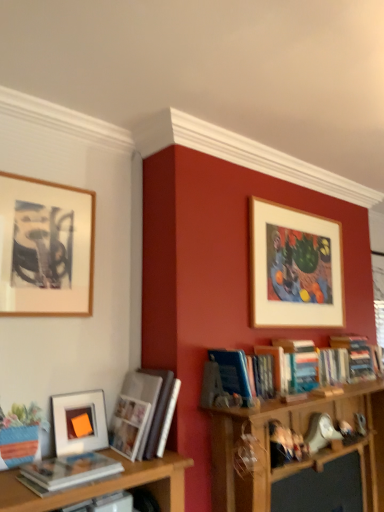
Question: Should I look upward or downward to see blue hardcover book at center-right, which is counted as the third book, starting from the right?

Choices:
 (A) up
 (B) down

Answer: (B)

Question: Is wooden framed artwork at upper left, the first picture frame positioned from the left, further to the viewer compared to hardcover books at upper right, which ranks as the 5th book in left-to-right order?

Choices:
 (A) yes
 (B) no

Answer: (B)

Question: Is hardcover books at upper right, which ranks as the 5th book in left-to-right order, a part of wooden framed artwork at upper left, placed as the 1th picture frame when sorted from front to back?

Choices:
 (A) yes
 (B) no

Answer: (B)

Question: Are wooden framed artwork at upper left, which is the third picture frame in back-to-front order, and hardcover books at upper right, the first book when ordered from right to left, far apart?

Choices:
 (A) yes
 (B) no

Answer: (A)

Question: Is wooden framed artwork at upper left, which is the third picture frame in back-to-front order, closer to the viewer compared to hardcover books at upper right, which ranks as the 5th book in left-to-right order?

Choices:
 (A) no
 (B) yes

Answer: (B)

Question: From a real-world perspective, is wooden framed artwork at upper left, placed as the 1th picture frame when sorted from front to back, over hardcover books at upper right, the first book when ordered from right to left?

Choices:
 (A) no
 (B) yes

Answer: (B)

Question: Is wooden framed artwork at upper left, the 3th picture frame positioned from the right, next to hardcover books at upper right, which ranks as the 5th book in left-to-right order?

Choices:
 (A) yes
 (B) no

Answer: (B)

Question: From the image's perspective, is matte white book at lower left, the 1th book when ordered from left to right, located beneath hardcover book at upper right, which is the 4th book from left to right?

Choices:
 (A) yes
 (B) no

Answer: (A)

Question: Is matte white book at lower left, which ranks as the fifth book in right-to-left order, wider than hardcover book at upper right, arranged as the second book when viewed from the right?

Choices:
 (A) yes
 (B) no

Answer: (A)

Question: Is matte white book at lower left, the 1th book when ordered from left to right, oriented towards hardcover book at upper right, which is the 4th book from left to right?

Choices:
 (A) yes
 (B) no

Answer: (B)

Question: Considering the relative sizes of matte white book at lower left, the 1th book when ordered from left to right, and hardcover book at upper right, which is the 4th book from left to right, in the image provided, is matte white book at lower left, the 1th book when ordered from left to right, thinner than hardcover book at upper right, which is the 4th book from left to right,?

Choices:
 (A) yes
 (B) no

Answer: (B)

Question: Is matte white book at lower left, the 1th book when ordered from left to right, outside hardcover book at upper right, arranged as the second book when viewed from the right?

Choices:
 (A) yes
 (B) no

Answer: (A)

Question: Is matte white book at lower left, the 1th book when ordered from left to right, facing away from hardcover book at upper right, which is the 4th book from left to right?

Choices:
 (A) yes
 (B) no

Answer: (B)

Question: Can you confirm if white glossy photo album at left, arranged as the 4th book when viewed from the right, is thinner than matte white book at lower left, which ranks as the fifth book in right-to-left order?

Choices:
 (A) no
 (B) yes

Answer: (A)